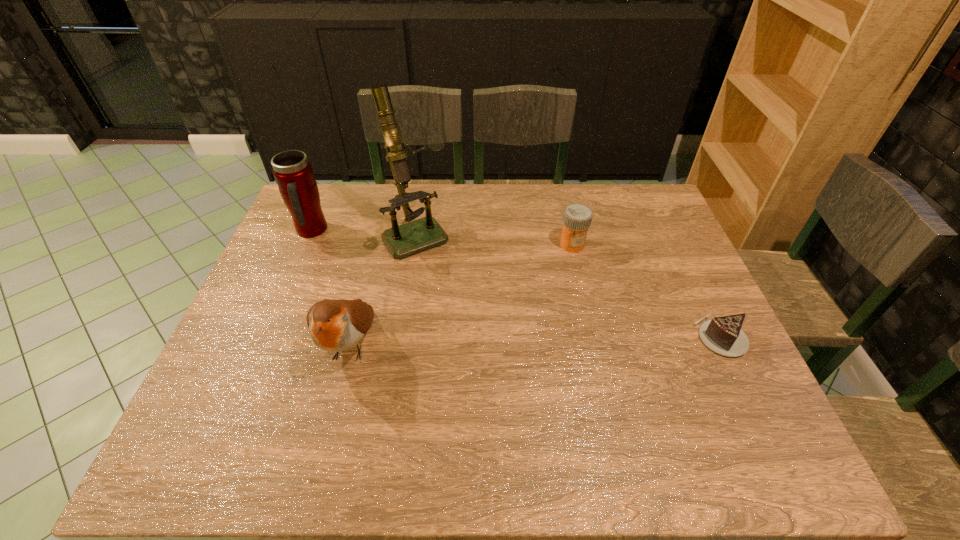
The height and width of the screenshot is (540, 960). Find the location of `free space on the desktop that is between the bird and the rightmost object and is positioned at the eyepiece of the tallest object`. free space on the desktop that is between the bird and the rightmost object and is positioned at the eyepiece of the tallest object is located at coordinates (492, 341).

Where is `free space on the desktop that is between the third shortest object and the rightmost object and is positioned on the label side of the medicine`? Image resolution: width=960 pixels, height=540 pixels. free space on the desktop that is between the third shortest object and the rightmost object and is positioned on the label side of the medicine is located at coordinates (554, 340).

Locate an element on the screen. Image resolution: width=960 pixels, height=540 pixels. free spot on the desktop that is between the third tallest object and the rightmost object and is positioned on the side with the handle of the leftmost object is located at coordinates (488, 341).